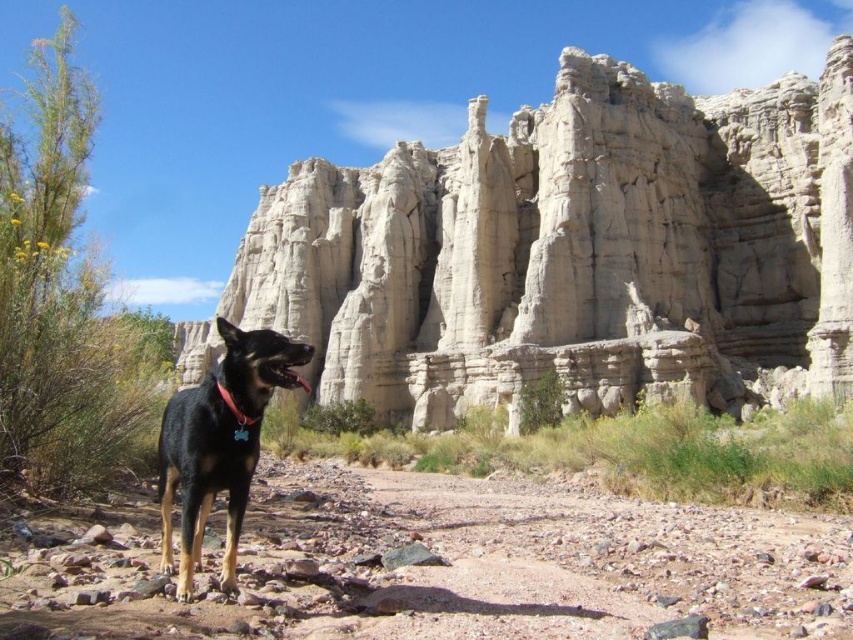
Question: Can you confirm if smooth sandstone rock formation at center is bigger than brown gravelly dirt track at center?

Choices:
 (A) no
 (B) yes

Answer: (B)

Question: Which object is farther from the camera taking this photo?

Choices:
 (A) brown gravelly dirt track at center
 (B) black matte dog at center

Answer: (B)

Question: Does smooth sandstone rock formation at center have a greater width compared to brown gravelly dirt track at center?

Choices:
 (A) no
 (B) yes

Answer: (B)

Question: Which point is farther to the camera?

Choices:
 (A) (409, 528)
 (B) (306, 348)
 (C) (728, 397)

Answer: (C)

Question: Which is nearer to the smooth sandstone rock formation at center?

Choices:
 (A) brown gravelly dirt track at center
 (B) black matte dog at center

Answer: (B)

Question: In this image, where is brown gravelly dirt track at center located relative to black matte dog at center?

Choices:
 (A) below
 (B) above

Answer: (A)